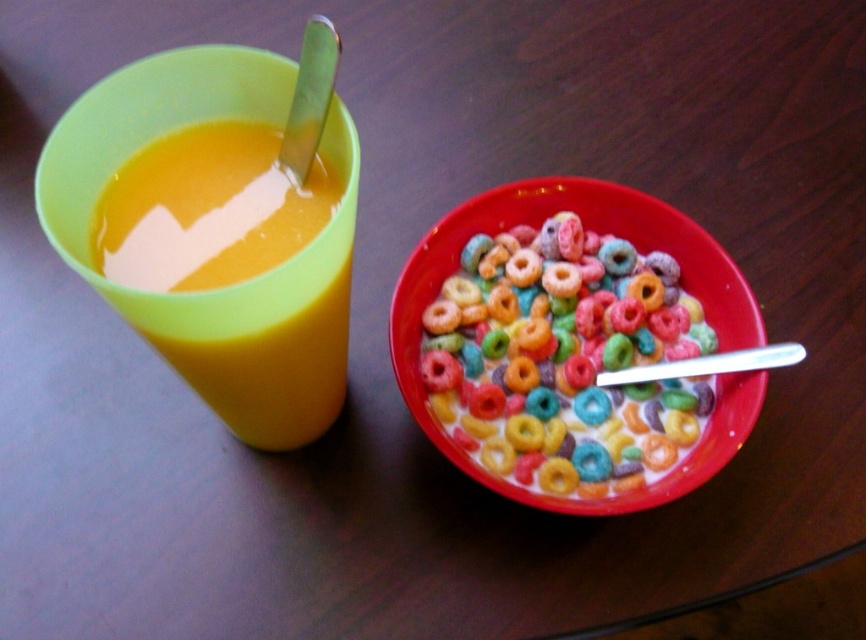
Question: Can you confirm if multicolored plastic cereal at center is wider than translucent plastic cup at left?

Choices:
 (A) yes
 (B) no

Answer: (A)

Question: Among these objects, which one is farthest from the camera?

Choices:
 (A) translucent plastic cup at left
 (B) multicolored plastic cereal at center

Answer: (B)

Question: Is the position of multicolored plastic cereal at center less distant than that of translucent plastic cup at left?

Choices:
 (A) no
 (B) yes

Answer: (A)

Question: Can you confirm if multicolored plastic cereal at center is positioned to the left of translucent plastic cup at left?

Choices:
 (A) yes
 (B) no

Answer: (B)

Question: Which of the following is the closest to the observer?

Choices:
 (A) translucent plastic cup at left
 (B) multicolored plastic cereal at center

Answer: (A)